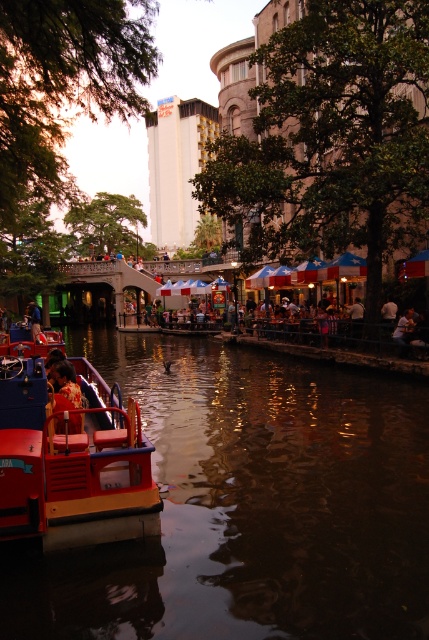
You are standing next to a camera on the riverbank and want to take a photo of the red plastic boat at lower left. If the camera has a maximum zoom range of 6 meters, will you be able to capture the boat clearly without moving closer?

The red plastic boat at lower left and the camera are 6.53 meters apart. Since the camera can only zoom up to 6 meters, you won there will not be able to capture the boat clearly without moving closer because the distance exceeds the maximum zoom range.